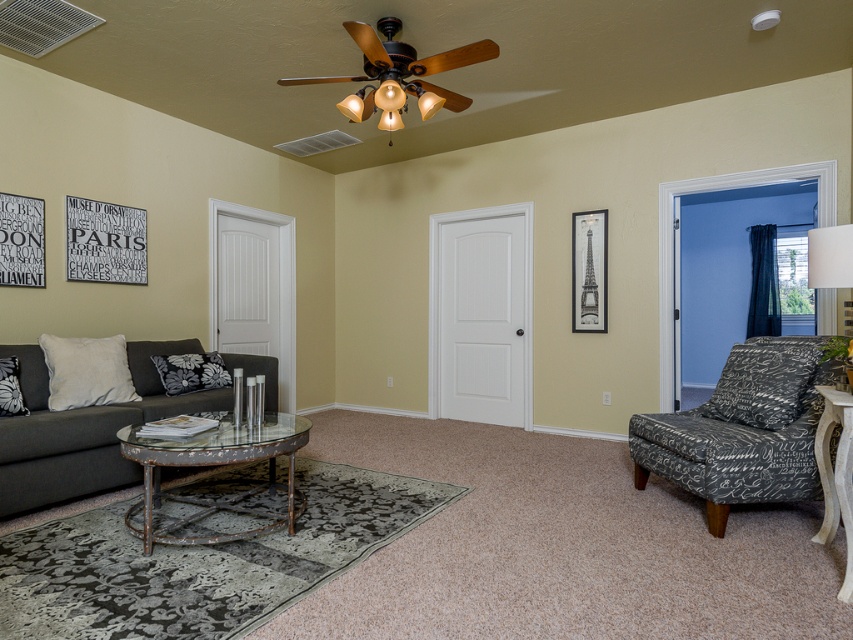
Question: Which point is farther to the camera?

Choices:
 (A) (808, 248)
 (B) (851, 492)

Answer: (A)

Question: Which is nearer to the white fabric lampshade at upper right?

Choices:
 (A) matte brown ceiling fan at upper center
 (B) rustic metal coffee table at center
 (C) dark gray fabric couch at left

Answer: (A)

Question: Observing the image, what is the correct spatial positioning of matte brown ceiling fan at upper center in reference to white fabric lampshade at upper right?

Choices:
 (A) left
 (B) right

Answer: (A)

Question: Is dark gray fabric couch at left smaller than white wood side table at lower right?

Choices:
 (A) no
 (B) yes

Answer: (A)

Question: Which of these objects is positioned closest to the dark gray fabric armchair at right?

Choices:
 (A) white wood side table at lower right
 (B) dark gray fabric couch at left

Answer: (A)

Question: Is dark gray fabric armchair at right bigger than white fabric lampshade at upper right?

Choices:
 (A) yes
 (B) no

Answer: (A)